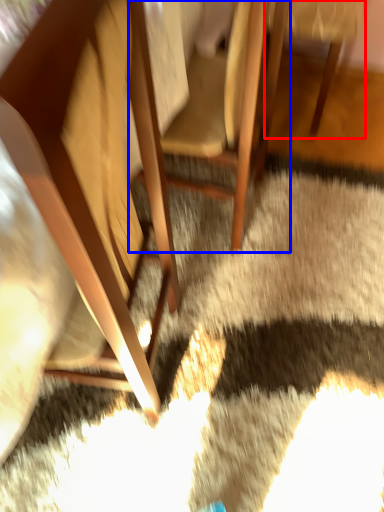
Question: Which object is closer to the camera taking this photo, chair (highlighted by a red box) or chair (highlighted by a blue box)?

Choices:
 (A) chair
 (B) chair

Answer: (B)